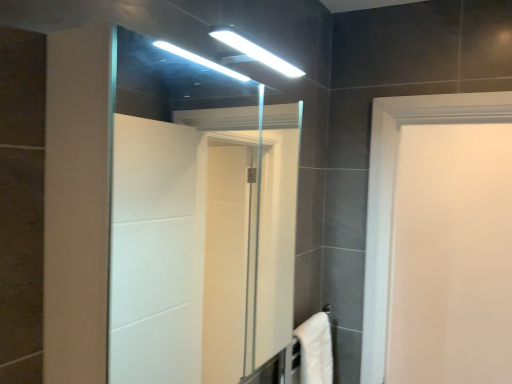
This screenshot has width=512, height=384. Find the location of `white soft towel at lower right`. white soft towel at lower right is located at coordinates 315,350.

Describe the element at coordinates (315, 350) in the screenshot. I see `white soft towel at lower right` at that location.

Locate an element on the screen. The height and width of the screenshot is (384, 512). white soft towel at lower right is located at coordinates (315, 350).